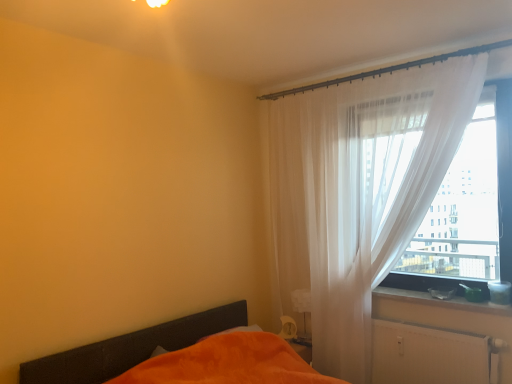
Question: Can you confirm if white matte radiator at lower right is smaller than orange fabric bed at lower left?

Choices:
 (A) no
 (B) yes

Answer: (B)

Question: Is white matte radiator at lower right facing towards orange fabric bed at lower left?

Choices:
 (A) no
 (B) yes

Answer: (B)

Question: Is white matte radiator at lower right not inside orange fabric bed at lower left?

Choices:
 (A) no
 (B) yes

Answer: (B)

Question: From a real-world perspective, does white matte radiator at lower right stand above orange fabric bed at lower left?

Choices:
 (A) yes
 (B) no

Answer: (A)

Question: Is white matte radiator at lower right further to camera compared to orange fabric bed at lower left?

Choices:
 (A) no
 (B) yes

Answer: (B)

Question: Does white matte radiator at lower right contain orange fabric bed at lower left?

Choices:
 (A) yes
 (B) no

Answer: (B)

Question: Is white sheer curtain at right taller than orange fabric bed at lower left?

Choices:
 (A) no
 (B) yes

Answer: (B)

Question: Is white sheer curtain at right not close to orange fabric bed at lower left?

Choices:
 (A) yes
 (B) no

Answer: (A)

Question: Considering the relative sizes of white sheer curtain at right and orange fabric bed at lower left in the image provided, is white sheer curtain at right shorter than orange fabric bed at lower left?

Choices:
 (A) yes
 (B) no

Answer: (B)

Question: Does white sheer curtain at right appear on the left side of orange fabric bed at lower left?

Choices:
 (A) no
 (B) yes

Answer: (A)

Question: From the image's perspective, is white sheer curtain at right located beneath orange fabric bed at lower left?

Choices:
 (A) no
 (B) yes

Answer: (A)

Question: Does white sheer curtain at right have a greater width compared to orange fabric bed at lower left?

Choices:
 (A) yes
 (B) no

Answer: (B)

Question: Is orange fabric bed at lower left oriented away from white matte radiator at lower right?

Choices:
 (A) no
 (B) yes

Answer: (A)